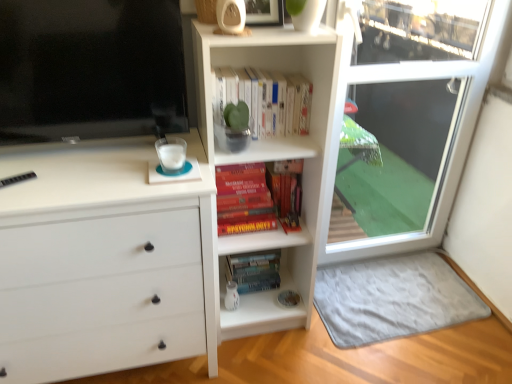
You are a GUI agent. You are given a task and a screenshot of the screen. Output one action in this format:
    pyautogui.click(x=<x>, y=<y>)
    Task: Click on the free space above white matte chest of drawers at left (from a real-world perspective)
    This screenshot has height=384, width=512.
    Given the screenshot: What is the action you would take?
    pyautogui.click(x=108, y=160)